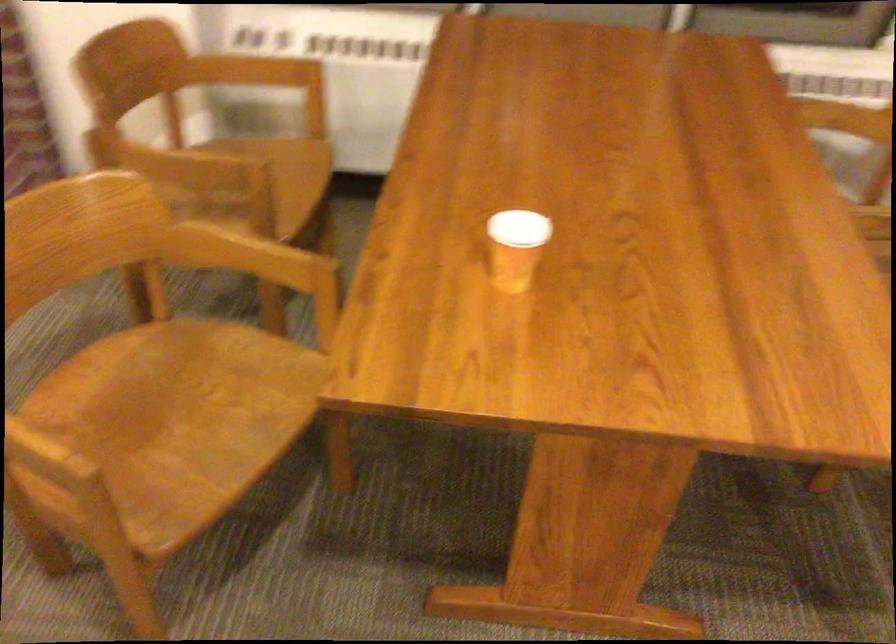
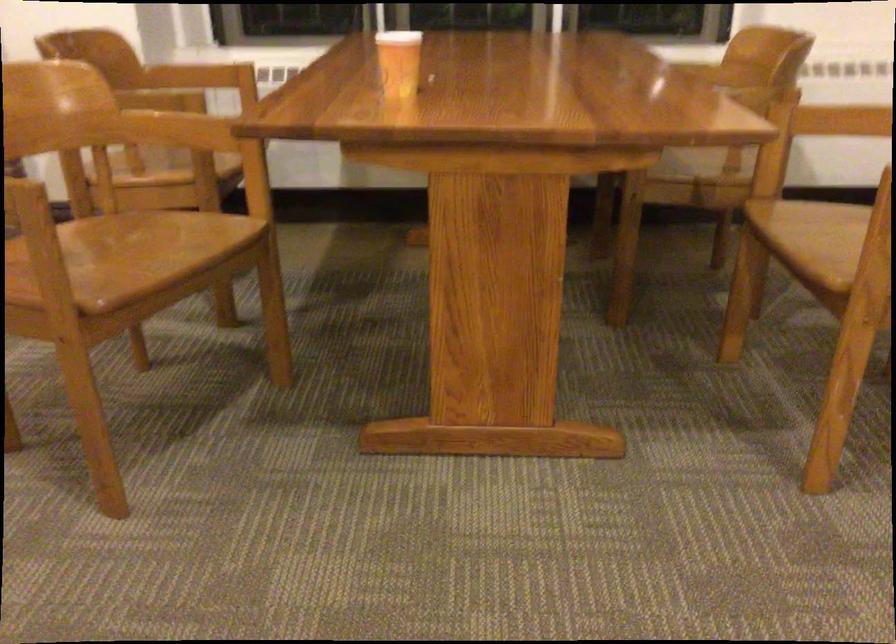
Which direction would the cameraman need to move to produce the second image?

The movement direction of the cameraman is right, backward.